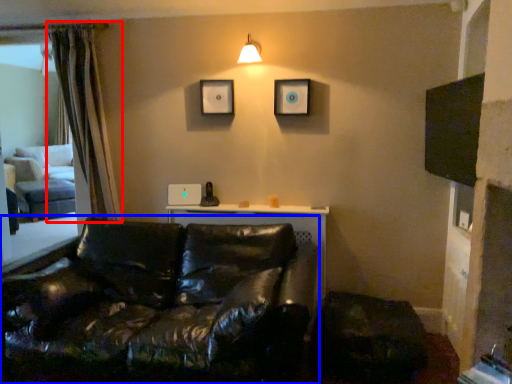
Question: Which point is further to the camera, curtain (highlighted by a red box) or studio couch (highlighted by a blue box)?

Choices:
 (A) curtain
 (B) studio couch

Answer: (A)